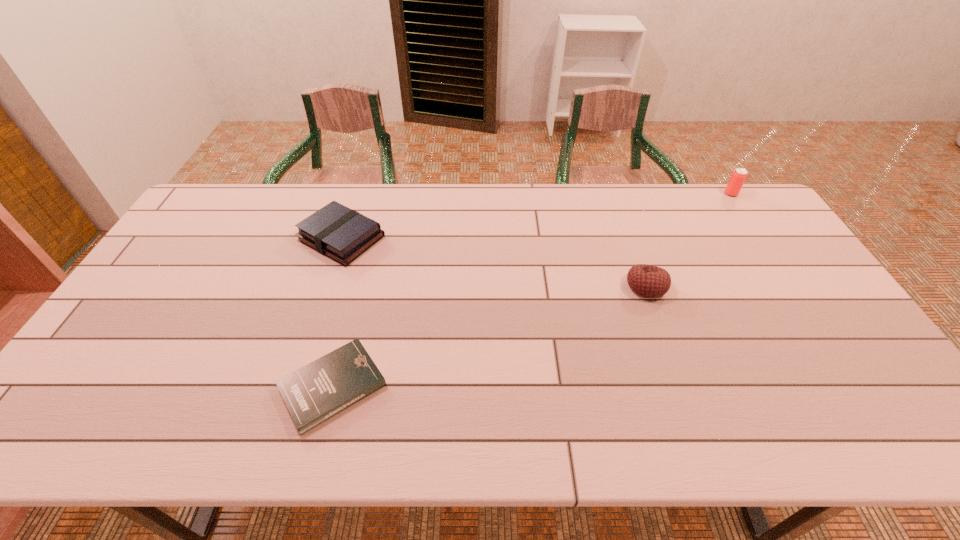
Locate an element on the screen. The height and width of the screenshot is (540, 960). free space between the beanbag and the shorter book is located at coordinates (490, 336).

You are a GUI agent. You are given a task and a screenshot of the screen. Output one action in this format:
    pyautogui.click(x=<x>, y=<y>)
    Task: Click on the unoccupied position between the third object from left to right and the taller book
    
    Given the screenshot: What is the action you would take?
    pyautogui.click(x=493, y=262)

Where is `vacant area between the second nearest object and the tallest object`? The width and height of the screenshot is (960, 540). vacant area between the second nearest object and the tallest object is located at coordinates (688, 240).

You are a GUI agent. You are given a task and a screenshot of the screen. Output one action in this format:
    pyautogui.click(x=<x>, y=<y>)
    Task: Click on the free space between the second farthest object and the second object from right to left
    The height and width of the screenshot is (540, 960).
    Given the screenshot: What is the action you would take?
    pyautogui.click(x=493, y=262)

Locate an element on the screen. vacant point located between the taller book and the beer can is located at coordinates (537, 216).

Find the location of a particular element. free space between the third nearest object and the nearer book is located at coordinates (337, 312).

Locate an element on the screen. The image size is (960, 540). vacant point located between the third object from left to right and the nearer book is located at coordinates (490, 336).

At what (x,y) coordinates should I click in order to perform the action: click on vacant space that is in between the second nearest object and the nearer book. Please return your answer as a coordinate pair (x, y). This screenshot has height=540, width=960. Looking at the image, I should click on (490, 336).

Where is `free spot between the shorter book and the second tallest object`? The width and height of the screenshot is (960, 540). free spot between the shorter book and the second tallest object is located at coordinates (490, 336).

The width and height of the screenshot is (960, 540). In order to click on vacant space that's between the shortest object and the farther book in this screenshot , I will do `click(337, 312)`.